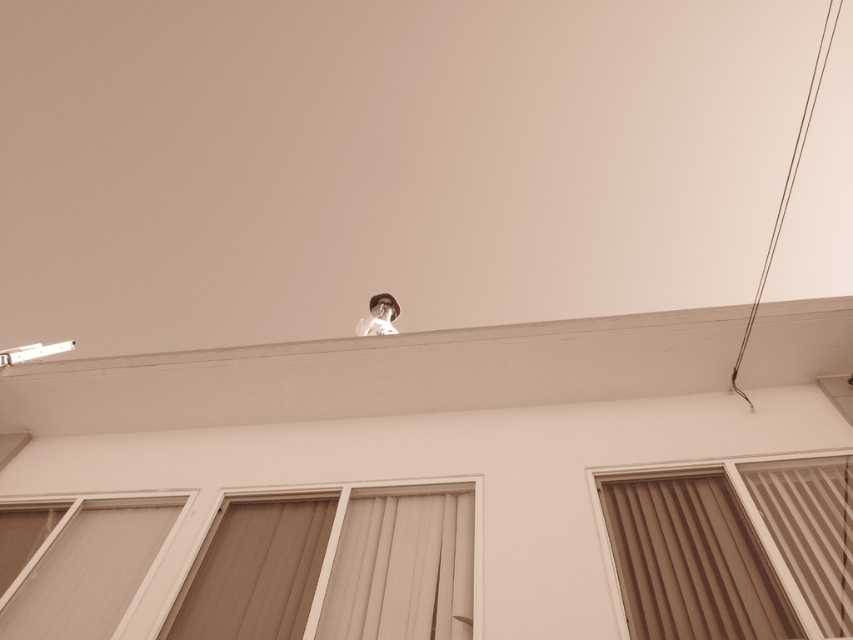
Question: Where is matte brown blinds at lower right located in relation to matte glass window at lower left in the image?

Choices:
 (A) right
 (B) left

Answer: (A)

Question: Which is nearer to the beige textured curtain at center?

Choices:
 (A) white glossy portrait at upper center
 (B) matte glass window at lower left
 (C) matte brown blinds at lower right

Answer: (C)

Question: Which point is closer to the camera taking this photo?

Choices:
 (A) (352, 536)
 (B) (376, 298)
 (C) (44, 600)
 (D) (802, 468)

Answer: (C)

Question: Does beige textured curtain at center have a smaller size compared to matte glass window at lower left?

Choices:
 (A) yes
 (B) no

Answer: (A)

Question: Which object is closer to the camera taking this photo?

Choices:
 (A) matte glass window at lower left
 (B) beige textured curtain at center
 (C) white glossy portrait at upper center

Answer: (B)

Question: Is beige textured curtain at center to the left of matte glass window at lower left from the viewer's perspective?

Choices:
 (A) yes
 (B) no

Answer: (B)